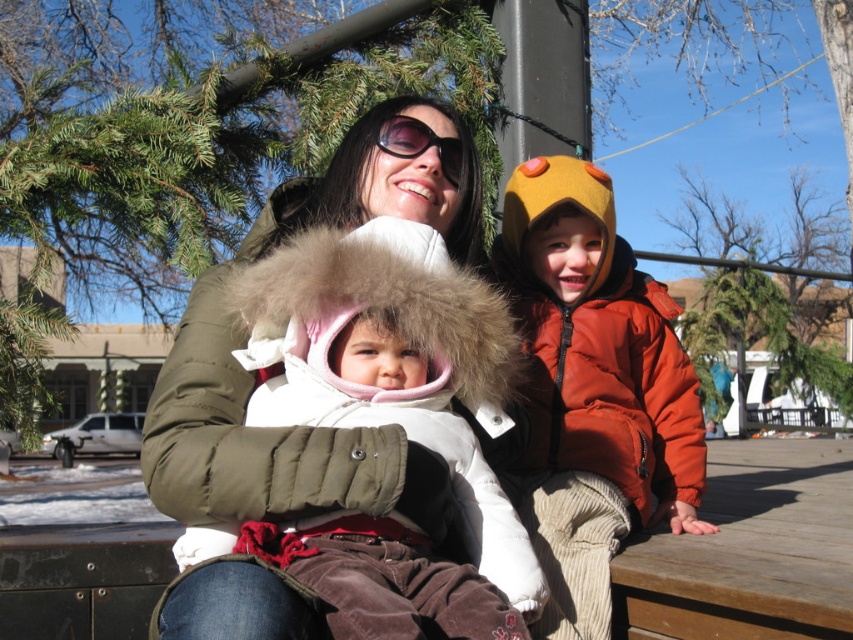
This screenshot has width=853, height=640. Describe the element at coordinates (605, 381) in the screenshot. I see `orange puffy jacket at right` at that location.

Is orange puffy jacket at right to the right of sunglasses at center from the viewer's perspective?

Indeed, orange puffy jacket at right is positioned on the right side of sunglasses at center.

Is point (583, 317) closer to viewer compared to point (401, 125)?

No, it is not.

Locate an element on the screen. orange puffy jacket at right is located at coordinates (605, 381).

Does white fur coat at center have a smaller size compared to sunglasses at center?

Actually, white fur coat at center might be larger than sunglasses at center.

Is white fur coat at center positioned at the back of sunglasses at center?

That is False.

Is point (479, 552) farther from viewer compared to point (410, 132)?

That is False.

I want to click on white fur coat at center, so click(x=392, y=420).

Which is below, white fur coat at center or orange puffy jacket at right?

white fur coat at center is below.

Which of these two, white fur coat at center or orange puffy jacket at right, stands taller?

With more height is orange puffy jacket at right.

What are the coordinates of `white fur coat at center` in the screenshot? It's located at (392, 420).

Where is `white fur coat at center`? white fur coat at center is located at coordinates (392, 420).